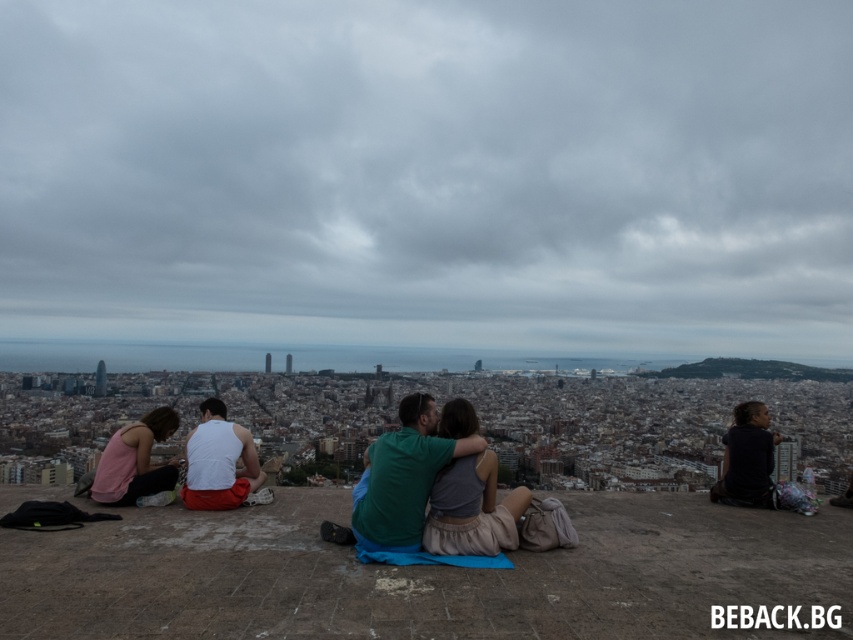
Question: Does white matte tank top at center lie in front of pink fabric at left?

Choices:
 (A) no
 (B) yes

Answer: (A)

Question: Is white matte tank top at center bigger than pink fabric at left?

Choices:
 (A) no
 (B) yes

Answer: (B)

Question: Which point is closer to the camera taking this photo?

Choices:
 (A) (247, 451)
 (B) (140, 426)

Answer: (B)

Question: Can you confirm if white matte tank top at center is positioned below pink fabric at left?

Choices:
 (A) no
 (B) yes

Answer: (A)

Question: Which point is closer to the camera?

Choices:
 (A) pink fabric at left
 (B) white matte tank top at center

Answer: (A)

Question: Which point is farther to the camera?

Choices:
 (A) white matte tank top at center
 (B) pink fabric at left

Answer: (A)